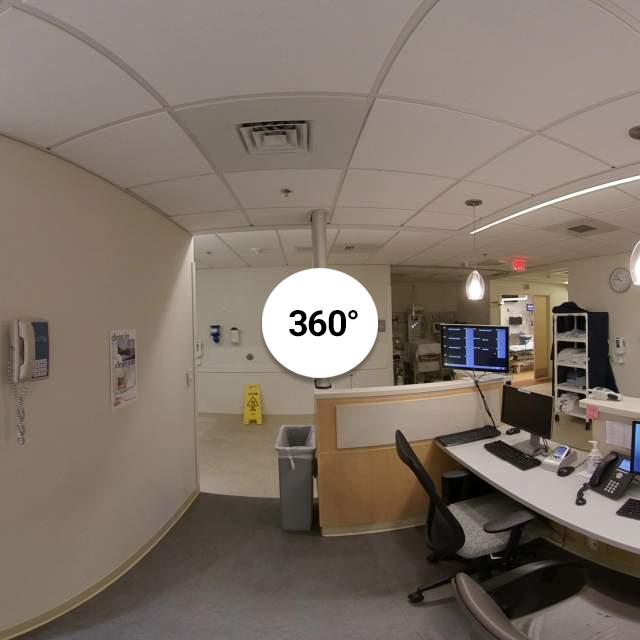
Find the location of `tile floor`. tile floor is located at coordinates (243, 452).